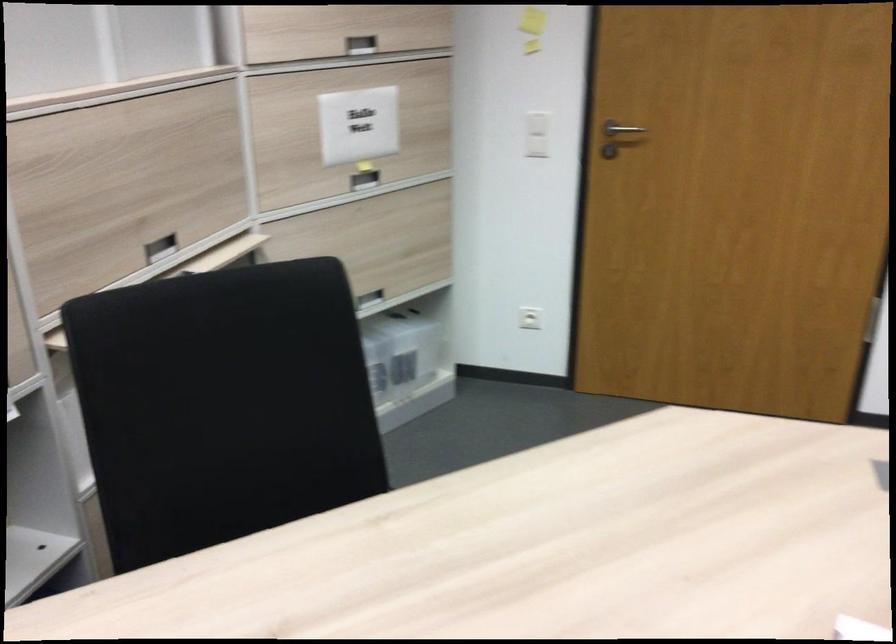
You are a GUI agent. You are given a task and a screenshot of the screen. Output one action in this format:
    pyautogui.click(x=<x>, y=<y>)
    Task: Click on the metal door handle
    The image size is (896, 644).
    Given the screenshot: What is the action you would take?
    pyautogui.click(x=619, y=129)